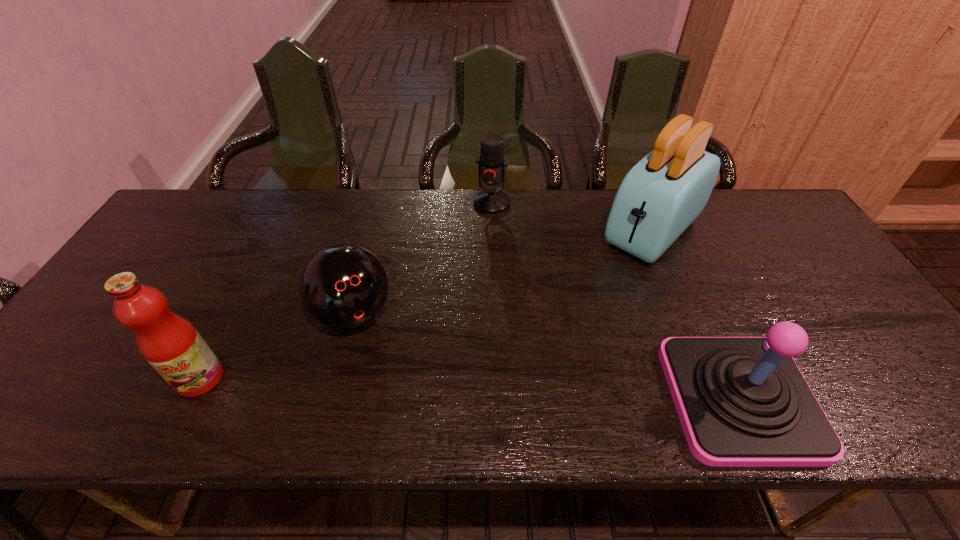
Find the location of `free spot that satisfies the following two spatial constraints: 1. on the front label of the fruit juice; 2. forward from the base of the joystick`. free spot that satisfies the following two spatial constraints: 1. on the front label of the fruit juice; 2. forward from the base of the joystick is located at coordinates (190, 399).

Find the location of `free space that satisfies the following two spatial constraints: 1. on the front side of the third object from left to right; 2. forward from the base of the joystick`. free space that satisfies the following two spatial constraints: 1. on the front side of the third object from left to right; 2. forward from the base of the joystick is located at coordinates (497, 399).

Locate an element on the screen. blank space that satisfies the following two spatial constraints: 1. on the front label of the joystick; 2. forward from the base of the fruit juice is located at coordinates (190, 399).